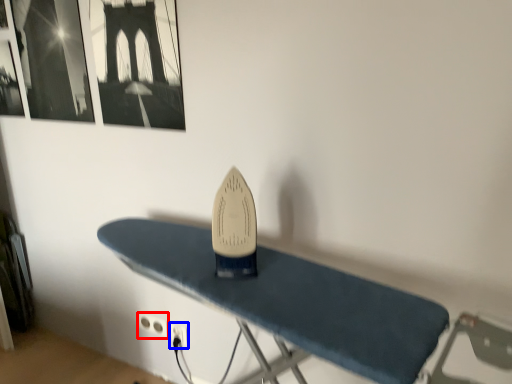
Question: Among these objects, which one is farthest to the camera, plug (highlighted by a red box) or plug (highlighted by a blue box)?

Choices:
 (A) plug
 (B) plug

Answer: (A)